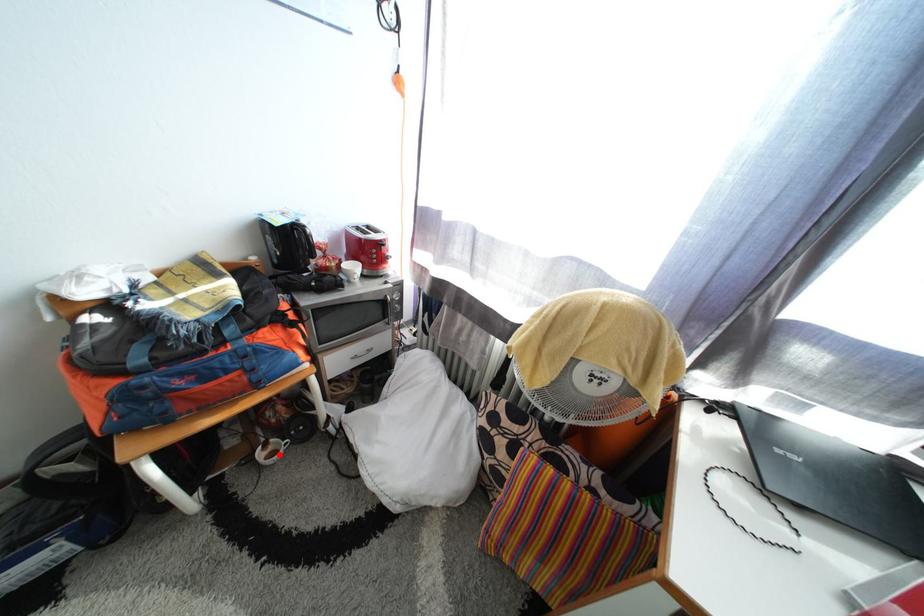
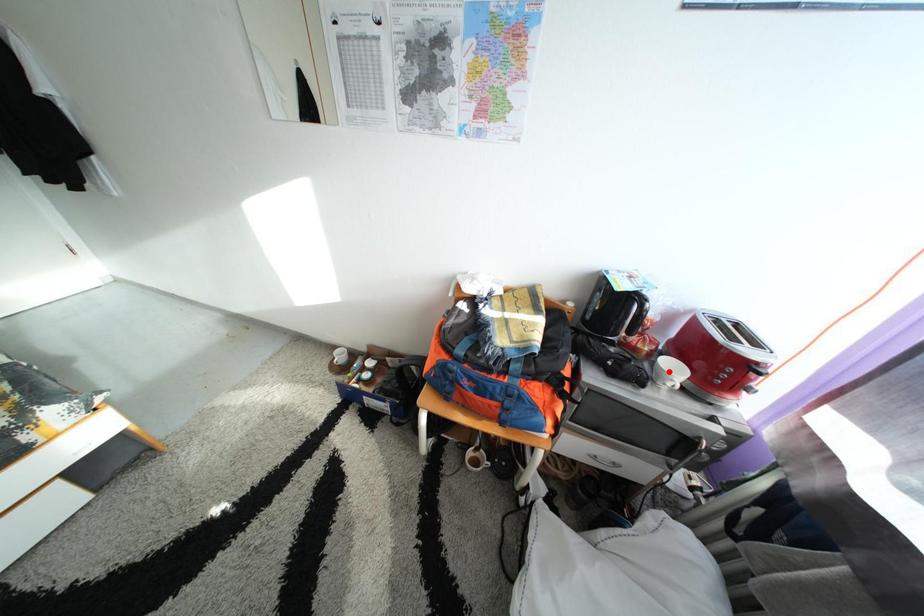
I am providing you with two images of the same scene from different viewpoints. A red point is marked on the first image and another point is marked on the second image. Is the marked point in image1 the same physical position as the marked point in image2?

No